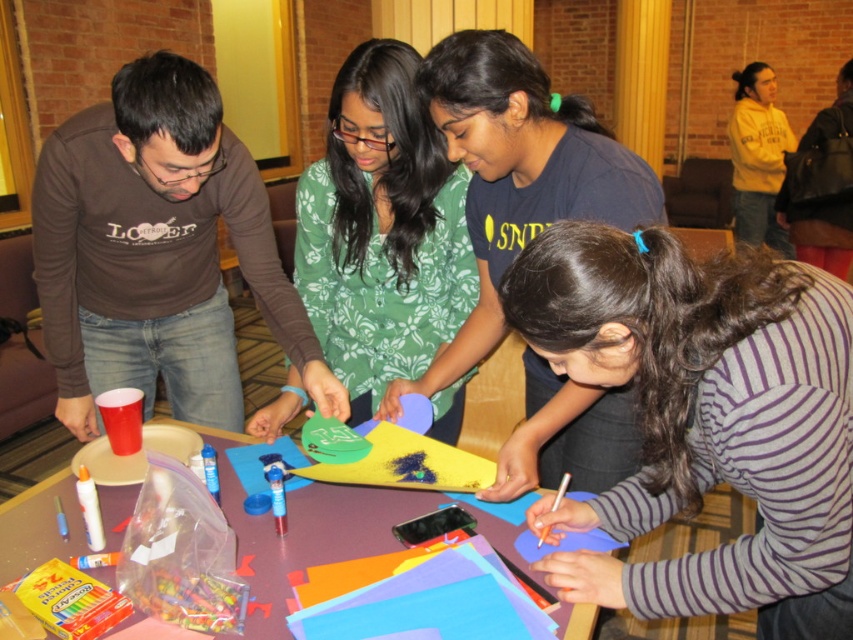
Question: Which object is farther from the camera taking this photo?

Choices:
 (A) matte blue shirt at center
 (B) striped fabric shirt at center
 (C) yellow fleece sweatshirt at upper right

Answer: (C)

Question: Which point is closer to the camera?

Choices:
 (A) yellow fleece sweatshirt at upper right
 (B) green floral shirt at center
 (C) matte plastic table at center
 (D) striped fabric shirt at center

Answer: (D)

Question: Is striped fabric shirt at center to the right of matte blue shirt at center from the viewer's perspective?

Choices:
 (A) yes
 (B) no

Answer: (A)

Question: Observing the image, what is the correct spatial positioning of green floral shirt at center in reference to yellow fleece sweatshirt at upper right?

Choices:
 (A) above
 (B) below

Answer: (B)

Question: Which object appears farthest from the camera in this image?

Choices:
 (A) yellow fleece sweatshirt at upper right
 (B) matte blue shirt at center
 (C) green floral shirt at center
 (D) striped fabric shirt at center

Answer: (A)

Question: Is striped fabric shirt at center bigger than green floral shirt at center?

Choices:
 (A) no
 (B) yes

Answer: (A)